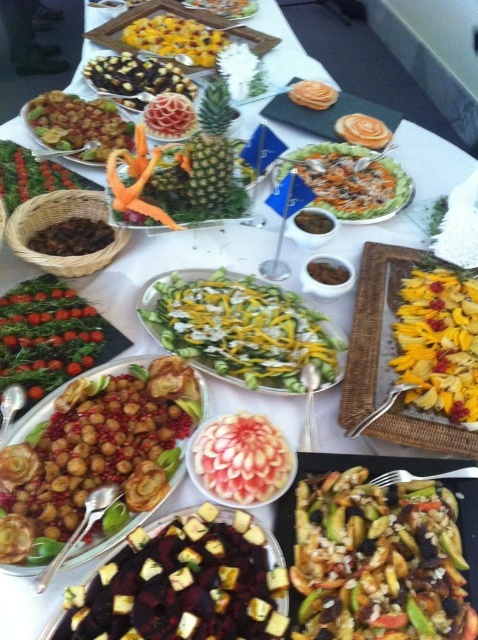
Is chocolate cake at center bigger than dark brown sauce at center?

Yes.

Is point (119, 65) positioned after point (317, 228)?

Yes, it is behind point (317, 228).

The height and width of the screenshot is (640, 478). I want to click on chocolate cake at center, so click(136, 77).

Does shiny silver bowl at center have a greater height compared to chocolate cake at center?

Correct, shiny silver bowl at center is much taller as chocolate cake at center.

Does shiny silver bowl at center have a larger size compared to chocolate cake at center?

Yes, shiny silver bowl at center is bigger than chocolate cake at center.

Does point (326, 180) come in front of point (145, 93)?

Yes, it is in front of point (145, 93).

The height and width of the screenshot is (640, 478). Find the location of `shiny silver bowl at center`. shiny silver bowl at center is located at coordinates (349, 180).

Does green leafy vegetable at center have a lesser height compared to green textured pineapple at center?

Yes, green leafy vegetable at center is shorter than green textured pineapple at center.

What do you see at coordinates (45, 336) in the screenshot? I see `green leafy vegetable at center` at bounding box center [45, 336].

In order to click on green leafy vegetable at center in this screenshot , I will do `click(45, 336)`.